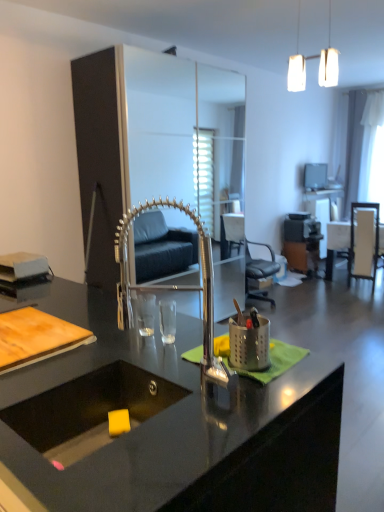
Locate an element on the screen. white matte pendant lights at upper center is located at coordinates (310, 59).

The height and width of the screenshot is (512, 384). Describe the element at coordinates (173, 285) in the screenshot. I see `polished chrome faucet at center` at that location.

This screenshot has height=512, width=384. I want to click on metallic brown computer desk at center, so click(x=301, y=241).

Where is `matte silver television at upper right`? This screenshot has width=384, height=512. matte silver television at upper right is located at coordinates (315, 176).

Would you say black granite sink at center contains black leather chair at center, acting as the 1th chair starting from the left?

Definitely not — black leather chair at center, acting as the 1th chair starting from the left, is not inside black granite sink at center.

Which is more to the right, black granite sink at center or black leather chair at center, which is the 2th chair in right-to-left order?

Positioned to the right is black leather chair at center, which is the 2th chair in right-to-left order.

From a real-world perspective, between black granite sink at center and black leather chair at center, which is the 2th chair in right-to-left order, who is vertically higher?

In real-world perspective, black granite sink at center is above.

Is black granite sink at center positioned before black leather chair at center, acting as the 1th chair starting from the left?

Yes, black granite sink at center is in front of black leather chair at center, acting as the 1th chair starting from the left.

From the picture: Is black glossy desk at center beside white glossy table at right, which is counted as the 1th table, starting from the front?

They are not placed beside each other.

Is black glossy desk at center turned away from white glossy table at right, positioned as the second table in back-to-front order?

No.

From the image's perspective, is black glossy desk at center beneath white glossy table at right, which is counted as the 1th table, starting from the front?

Yes, from the image's perspective, black glossy desk at center is below white glossy table at right, which is counted as the 1th table, starting from the front.

Which of these two, black glossy desk at center or white glossy table at right, positioned as the second table in back-to-front order, is smaller?

With smaller size is white glossy table at right, positioned as the second table in back-to-front order.

Is matte silver television at upper right facing away from white glossy table at right, which is counted as the 1th table, starting from the front?

No.

From a real-world perspective, which is physically above, matte silver television at upper right or white glossy table at right, which is counted as the 1th table, starting from the front?

From a 3D spatial view, matte silver television at upper right is above.

Is white glossy table at right, which is counted as the 1th table, starting from the front, located within matte silver television at upper right?

No, white glossy table at right, which is counted as the 1th table, starting from the front, is not inside matte silver television at upper right.

Does point (314, 203) come farther from viewer compared to point (318, 238)?

Yes, point (314, 203) is farther from viewer.

The height and width of the screenshot is (512, 384). I want to click on the 2nd table above when counting from the metallic brown computer desk at center (from the image's perspective), so click(x=321, y=210).

Is white glossy table at right, acting as the first table starting from the back, turned away from metallic brown computer desk at center?

That's not correct — white glossy table at right, acting as the first table starting from the back, is not looking away from metallic brown computer desk at center.

Is metallic brown computer desk at center inside white glossy table at right, the 2th table in the front-to-back sequence?

That's incorrect, metallic brown computer desk at center is not inside white glossy table at right, the 2th table in the front-to-back sequence.

Which of these two, polished chrome faucet at center or metallic brown computer desk at center, stands shorter?

Standing shorter between the two is metallic brown computer desk at center.

Is point (134, 214) closer or farther from the camera than point (309, 232)?

Point (134, 214) is positioned closer to the camera compared to point (309, 232).

At what (x,y) coordinates should I click in order to perform the action: click on computer desk below the polished chrome faucet at center (from a real-world perspective). Please return your answer as a coordinate pair (x, y). Looking at the image, I should click on (301, 241).

How many degrees apart are the facing directions of polished chrome faucet at center and metallic brown computer desk at center?

They differ by 93 degrees in their facing directions.

Can you see metallic brown computer desk at center touching matte silver television at upper right?

No, metallic brown computer desk at center is not next to matte silver television at upper right.

Locate an element on the screen. computer desk below the matte silver television at upper right (from the image's perspective) is located at coordinates (301, 241).

Does metallic brown computer desk at center have a smaller size compared to matte silver television at upper right?

Incorrect, metallic brown computer desk at center is not smaller in size than matte silver television at upper right.

Are white matte pendant lights at upper center and matte silver television at upper right making contact?

No.

Which of these two, white matte pendant lights at upper center or matte silver television at upper right, stands shorter?

matte silver television at upper right is shorter.

From the picture: Does white matte pendant lights at upper center have a lesser width compared to matte silver television at upper right?

No.

Is the depth of white matte pendant lights at upper center less than that of matte silver television at upper right?

Yes, it is.

The height and width of the screenshot is (512, 384). What are the coordinates of `the 1st chair positioned above the black granite sink at center (from the image's perspective)` in the screenshot? It's located at (247, 255).

Locate an element on the screen. desk on the left of white glossy table at right, which is counted as the 1th table, starting from the front is located at coordinates (163, 424).

From the image, which object appears to be nearer to metallic brown computer desk at center, white glossy table at right, which is counted as the 1th table, starting from the front, or black granite sink at center?

white glossy table at right, which is counted as the 1th table, starting from the front, is positioned closer to the anchor metallic brown computer desk at center.

Based on their spatial positions, is white glossy table at right, which is counted as the 1th table, starting from the front, or black leather chair at center, which is the 2th chair in right-to-left order, further from black glossy desk at center?

white glossy table at right, which is counted as the 1th table, starting from the front, is further to black glossy desk at center.

Considering their positions, is white glossy table at right, positioned as the second table in back-to-front order, positioned closer to matte silver television at upper right than black leather chair at center, which is the 2th chair in right-to-left order?

white glossy table at right, positioned as the second table in back-to-front order.

Looking at the image, which one is located further to wooden chair at right, marked as the 1th chair in a right-to-left arrangement, white glossy table at right, positioned as the second table in back-to-front order, or polished chrome faucet at center?

polished chrome faucet at center.

Estimate the real-world distances between objects in this image. Which object is further from polished chrome faucet at center, black leather chair at center, which is the 2th chair in right-to-left order, or matte silver television at upper right?

matte silver television at upper right.

From the picture: Which object lies further to the anchor point metallic brown computer desk at center, white matte pendant lights at upper center or matte silver television at upper right?

Among the two, white matte pendant lights at upper center is located further to metallic brown computer desk at center.

From the image, which object appears to be farther from white matte pendant lights at upper center, black leather chair at center, acting as the 1th chair starting from the left, or metallic brown computer desk at center?

Based on the image, black leather chair at center, acting as the 1th chair starting from the left, appears to be further to white matte pendant lights at upper center.

Which object lies further to the anchor point polished chrome faucet at center, white glossy table at right, the 2th table in the front-to-back sequence, or matte silver television at upper right?

matte silver television at upper right lies further to polished chrome faucet at center than the other object.

Locate an element on the screen. faucet between black glossy desk at center and metallic brown computer desk at center from front to back is located at coordinates (173, 285).

This screenshot has height=512, width=384. I want to click on faucet positioned between black granite sink at center and white glossy table at right, acting as the first table starting from the back, from near to far, so click(x=173, y=285).

This screenshot has height=512, width=384. I want to click on lamp between polished chrome faucet at center and metallic brown computer desk at center along the z-axis, so click(310, 59).

This screenshot has width=384, height=512. I want to click on lamp positioned between black granite sink at center and black leather chair at center, which is the 2th chair in right-to-left order, from near to far, so click(x=310, y=59).